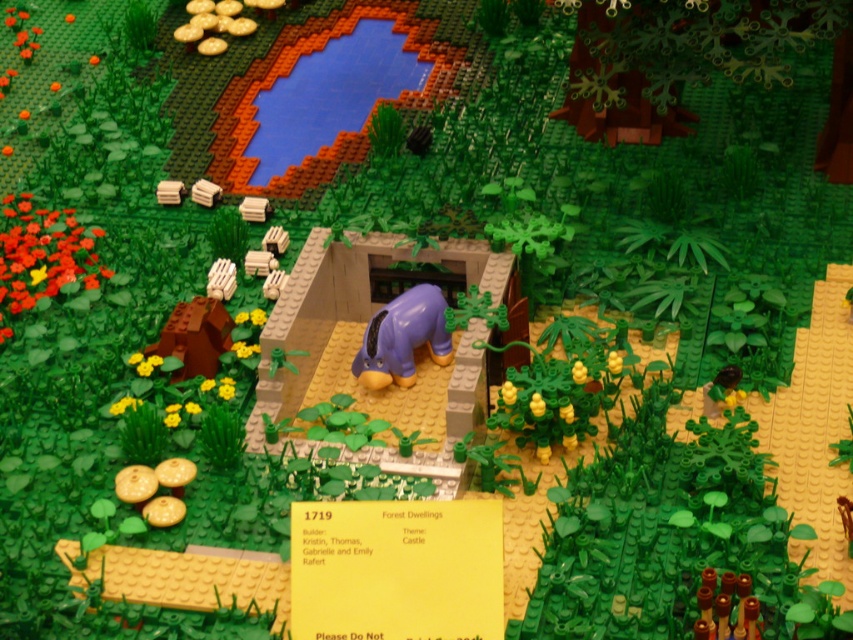
In the scene shown: You are a small LEGO figure trying to reach the cave entrance. You see wooden crates at upper center and wooden block at upper left. Which object can you use to climb higher to see the cave entrance better?

The wooden crates at upper center has a greater height compared to the wooden block at upper left, so you can climb the wooden crates at upper center to see the cave entrance better.